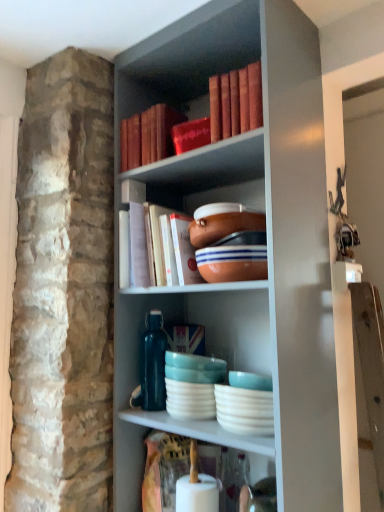
The height and width of the screenshot is (512, 384). What do you see at coordinates (232, 263) in the screenshot?
I see `matte orange bowl at center, positioned as the 1th bowl in bottom-to-top order` at bounding box center [232, 263].

What do you see at coordinates (144, 247) in the screenshot? I see `hardcover book at center, acting as the first book starting from the bottom` at bounding box center [144, 247].

Where is `matte orange bowl at center, the 1th bowl positioned from the top`? matte orange bowl at center, the 1th bowl positioned from the top is located at coordinates (224, 226).

At what (x,y) coordinates should I click in order to perform the action: click on matte red book at upper center, the first book when ordered from top to bottom. Please return your answer as a coordinate pair (x, y). Image resolution: width=384 pixels, height=512 pixels. Looking at the image, I should click on (148, 136).

You are a GUI agent. You are given a task and a screenshot of the screen. Output one action in this format:
    pyautogui.click(x=<x>, y=<y>)
    Task: Click on the matte orange bowl at center, positioned as the 2th bowl in top-to-bottom order
    The image size is (384, 512).
    Given the screenshot: What is the action you would take?
    pyautogui.click(x=232, y=263)

From a real-world perspective, is hardcover book at center, acting as the first book starting from the bottom, above or below matte red book at upper center, the first book when ordered from top to bottom?

Clearly, from a real-world perspective, hardcover book at center, acting as the first book starting from the bottom, is below matte red book at upper center, the first book when ordered from top to bottom.

Is hardcover book at center, the second book positioned from the top, shorter than matte red book at upper center, the first book when ordered from top to bottom?

In fact, hardcover book at center, the second book positioned from the top, may be taller than matte red book at upper center, the first book when ordered from top to bottom.

Can you confirm if hardcover book at center, the second book positioned from the top, is wider than matte red book at upper center, the first book when ordered from top to bottom?

Yes, hardcover book at center, the second book positioned from the top, is wider than matte red book at upper center, the first book when ordered from top to bottom.

Looking at this image, which is farther from the camera, (x=146, y=214) or (x=136, y=148)?

The point (x=136, y=148) is farther.

Is matte orange bowl at center, the 1th bowl positioned from the top, in contact with matte red book at upper center, the 2th book from the bottom?

No, matte orange bowl at center, the 1th bowl positioned from the top, is not making contact with matte red book at upper center, the 2th book from the bottom.

Considering the relative sizes of matte orange bowl at center, the 1th bowl positioned from the top, and matte red book at upper center, the first book when ordered from top to bottom, in the image provided, is matte orange bowl at center, the 1th bowl positioned from the top, thinner than matte red book at upper center, the first book when ordered from top to bottom,?

Indeed, matte orange bowl at center, the 1th bowl positioned from the top, has a lesser width compared to matte red book at upper center, the first book when ordered from top to bottom.

Which object is closer to the camera, matte orange bowl at center, positioned as the 2th bowl in bottom-to-top order, or matte red book at upper center, the 2th book from the bottom?

matte orange bowl at center, positioned as the 2th bowl in bottom-to-top order, is closer to the camera.

Is matte orange bowl at center, the 1th bowl positioned from the top, spatially inside matte red book at upper center, the first book when ordered from top to bottom, or outside of it?

matte orange bowl at center, the 1th bowl positioned from the top, exists outside the volume of matte red book at upper center, the first book when ordered from top to bottom.

From the image's perspective, would you say matte red book at upper center, the 2th book from the bottom, is shown under hardcover book at center, acting as the first book starting from the bottom?

Actually, matte red book at upper center, the 2th book from the bottom, appears above hardcover book at center, acting as the first book starting from the bottom, in the image.

Considering the positions of point (171, 125) and point (137, 273), is point (171, 125) closer or farther from the camera than point (137, 273)?

Point (171, 125) appears to be farther away from the viewer than point (137, 273).

In order to click on book that is below the matte red book at upper center, the first book when ordered from top to bottom (from the image's perspective) in this screenshot , I will do `click(144, 247)`.

Who is shorter, matte red book at upper center, the 2th book from the bottom, or hardcover book at center, acting as the first book starting from the bottom?

matte red book at upper center, the 2th book from the bottom.

Which object is closer to the camera taking this photo, matte red book at upper center, the first book when ordered from top to bottom, or matte orange bowl at center, positioned as the 1th bowl in bottom-to-top order?

matte orange bowl at center, positioned as the 1th bowl in bottom-to-top order.

Can you confirm if matte red book at upper center, the first book when ordered from top to bottom, is wider than matte orange bowl at center, positioned as the 2th bowl in top-to-bottom order?

No, matte red book at upper center, the first book when ordered from top to bottom, is not wider than matte orange bowl at center, positioned as the 2th bowl in top-to-bottom order.

Is matte red book at upper center, the first book when ordered from top to bottom, completely or partially outside of matte orange bowl at center, positioned as the 2th bowl in top-to-bottom order?

Absolutely, matte red book at upper center, the first book when ordered from top to bottom, is external to matte orange bowl at center, positioned as the 2th bowl in top-to-bottom order.

Is point (177, 353) farther from camera compared to point (140, 261)?

No, (177, 353) is in front of (140, 261).

From the image's perspective, which one is positioned lower, matte white ceramic plates at center or hardcover book at center, acting as the first book starting from the bottom?

matte white ceramic plates at center.

In the scene shown: Is matte white ceramic plates at center not close to hardcover book at center, the second book positioned from the top?

No, matte white ceramic plates at center is not far away from hardcover book at center, the second book positioned from the top.

Considering the positions of objects matte white ceramic plates at center and hardcover book at center, the second book positioned from the top, in the image provided, who is more to the right, matte white ceramic plates at center or hardcover book at center, the second book positioned from the top,?

From the viewer's perspective, matte white ceramic plates at center appears more on the right side.

Can you confirm if matte orange bowl at center, positioned as the 2th bowl in top-to-bottom order, is positioned to the left of matte white ceramic plates at center?

Incorrect, matte orange bowl at center, positioned as the 2th bowl in top-to-bottom order, is not on the left side of matte white ceramic plates at center.

Is matte orange bowl at center, positioned as the 1th bowl in bottom-to-top order, thinner than matte white ceramic plates at center?

Yes, matte orange bowl at center, positioned as the 1th bowl in bottom-to-top order, is thinner than matte white ceramic plates at center.

Is matte orange bowl at center, positioned as the 1th bowl in bottom-to-top order, not near matte white ceramic plates at center?

No, matte orange bowl at center, positioned as the 1th bowl in bottom-to-top order, is not far from matte white ceramic plates at center.

Is matte orange bowl at center, positioned as the 1th bowl in bottom-to-top order, positioned in front of matte white ceramic plates at center?

Yes, matte orange bowl at center, positioned as the 1th bowl in bottom-to-top order, is in front of matte white ceramic plates at center.

How much distance is there between hardcover book at center, the second book positioned from the top, and matte white ceramic plates at center?

They are 13.86 inches apart.

Can you tell me how much hardcover book at center, acting as the first book starting from the bottom, and matte white ceramic plates at center differ in facing direction?

There is a 0.0448-degree angle between the facing directions of hardcover book at center, acting as the first book starting from the bottom, and matte white ceramic plates at center.

Based on the photo, considering the sizes of objects hardcover book at center, the second book positioned from the top, and matte white ceramic plates at center in the image provided, who is thinner, hardcover book at center, the second book positioned from the top, or matte white ceramic plates at center?

matte white ceramic plates at center.

Can you confirm if hardcover book at center, the second book positioned from the top, is positioned to the right of matte white ceramic plates at center?

No, hardcover book at center, the second book positioned from the top, is not to the right of matte white ceramic plates at center.

I want to click on book on the right of matte red book at upper center, the 2th book from the bottom, so click(144, 247).

From a real-world perspective, which bowl is the 1st one underneath the matte red book at upper center, the first book when ordered from top to bottom? Please provide its 2D coordinates.

[(224, 226)]

Estimate the real-world distances between objects in this image. Which object is further from matte orange bowl at center, positioned as the 1th bowl in bottom-to-top order, hardcover book at center, acting as the first book starting from the bottom, or matte red book at upper center, the first book when ordered from top to bottom?

Among the two, matte red book at upper center, the first book when ordered from top to bottom, is located further to matte orange bowl at center, positioned as the 1th bowl in bottom-to-top order.

Based on their spatial positions, is matte red book at upper center, the first book when ordered from top to bottom, or matte orange bowl at center, positioned as the 2th bowl in top-to-bottom order, further from matte orange bowl at center, the 1th bowl positioned from the top?

Based on the image, matte red book at upper center, the first book when ordered from top to bottom, appears to be further to matte orange bowl at center, the 1th bowl positioned from the top.

Which object lies nearer to the anchor point matte red book at upper center, the first book when ordered from top to bottom, matte orange bowl at center, positioned as the 2th bowl in bottom-to-top order, or hardcover book at center, the second book positioned from the top?

hardcover book at center, the second book positioned from the top, is closer to matte red book at upper center, the first book when ordered from top to bottom.

Based on their spatial positions, is hardcover book at center, the second book positioned from the top, or matte orange bowl at center, positioned as the 2th bowl in top-to-bottom order, closer to matte red book at upper center, the 2th book from the bottom?

hardcover book at center, the second book positioned from the top, lies closer to matte red book at upper center, the 2th book from the bottom, than the other object.

Looking at the image, which one is located further to matte white ceramic plates at center, matte orange bowl at center, the 1th bowl positioned from the top, or hardcover book at center, acting as the first book starting from the bottom?

matte orange bowl at center, the 1th bowl positioned from the top, is further to matte white ceramic plates at center.

Based on their spatial positions, is matte red book at upper center, the first book when ordered from top to bottom, or matte orange bowl at center, the 1th bowl positioned from the top, further from hardcover book at center, acting as the first book starting from the bottom?

matte red book at upper center, the first book when ordered from top to bottom, is positioned further to the anchor hardcover book at center, acting as the first book starting from the bottom.

Looking at the image, which one is located closer to matte orange bowl at center, positioned as the 1th bowl in bottom-to-top order, matte orange bowl at center, the 1th bowl positioned from the top, or matte white ceramic plates at center?

matte orange bowl at center, the 1th bowl positioned from the top, lies closer to matte orange bowl at center, positioned as the 1th bowl in bottom-to-top order, than the other object.

Which object lies nearer to the anchor point matte white ceramic plates at center, matte orange bowl at center, the 1th bowl positioned from the top, or matte orange bowl at center, positioned as the 1th bowl in bottom-to-top order?

Based on the image, matte orange bowl at center, positioned as the 1th bowl in bottom-to-top order, appears to be nearer to matte white ceramic plates at center.

Identify the location of bowl between matte red book at upper center, the 2th book from the bottom, and matte orange bowl at center, positioned as the 2th bowl in top-to-bottom order, in the up-down direction. This screenshot has height=512, width=384. (224, 226).

The image size is (384, 512). In order to click on bowl between hardcover book at center, the second book positioned from the top, and matte orange bowl at center, positioned as the 2th bowl in top-to-bottom order, from left to right in this screenshot , I will do `click(224, 226)`.

At what (x,y) coordinates should I click in order to perform the action: click on bowl between matte red book at upper center, the 2th book from the bottom, and hardcover book at center, acting as the first book starting from the bottom, in the vertical direction. Please return your answer as a coordinate pair (x, y). The height and width of the screenshot is (512, 384). Looking at the image, I should click on (224, 226).

The width and height of the screenshot is (384, 512). What are the coordinates of `book between matte orange bowl at center, positioned as the 2th bowl in bottom-to-top order, and matte white ceramic plates at center from top to bottom` in the screenshot? It's located at (144, 247).